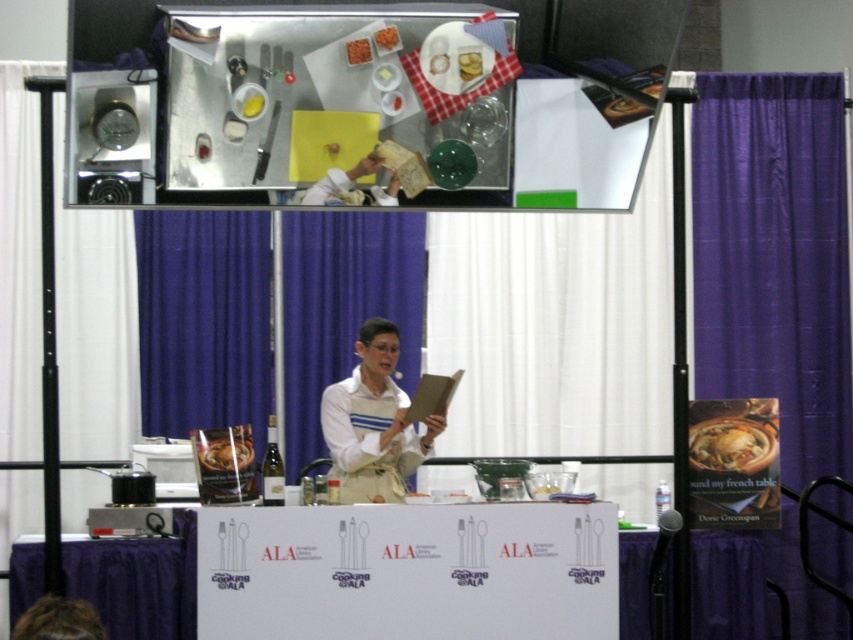
Question: Can you confirm if purple fabric curtain at right is wider than white fabric apron at center?

Choices:
 (A) yes
 (B) no

Answer: (A)

Question: Which object is closer to the camera taking this photo?

Choices:
 (A) blue fabric curtain at left
 (B) purple fabric table at lower left
 (C) purple fabric curtain at right
 (D) golden brown crusty bread at center

Answer: (B)

Question: Which of the following is the farthest from the observer?

Choices:
 (A) (779, 419)
 (B) (386, 378)
 (C) (97, 323)
 (D) (128, 572)

Answer: (A)

Question: Is blue fabric curtain at center below purple fabric table at lower left?

Choices:
 (A) no
 (B) yes

Answer: (A)

Question: Is golden brown crusty bread at center below orange shredded vegetable at center?

Choices:
 (A) no
 (B) yes

Answer: (B)

Question: Among these objects, which one is farthest from the camera?

Choices:
 (A) white paperboard at center
 (B) orange shredded vegetable at center

Answer: (A)